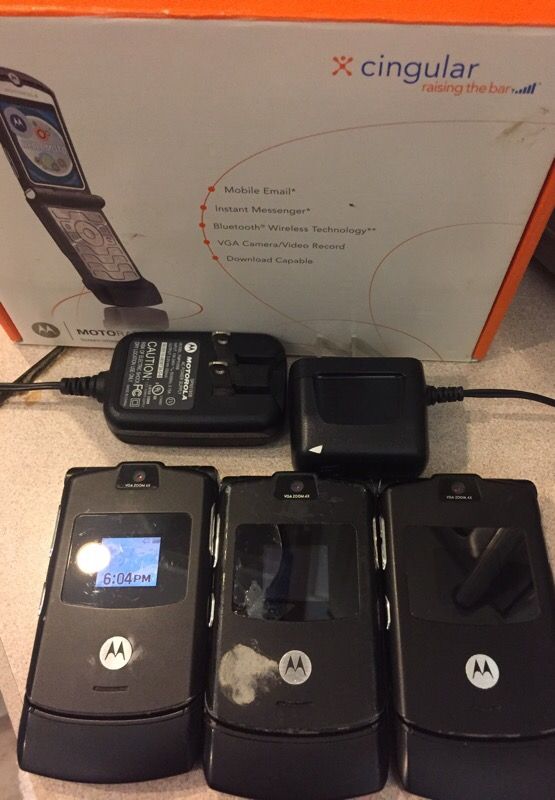
Identify the location of counter top. (27, 466).